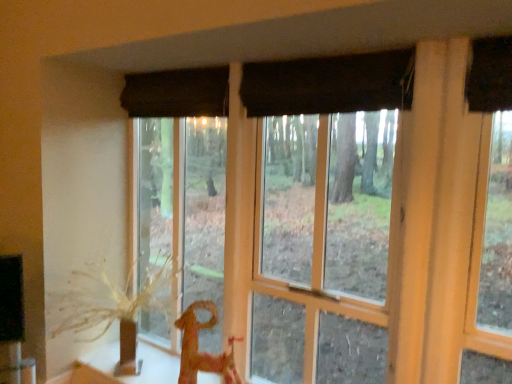
Question: From a real-world perspective, is black fabric curtain at upper center positioned above or below brown textured plant at left?

Choices:
 (A) above
 (B) below

Answer: (A)

Question: Choose the correct answer: Is black fabric curtain at upper center inside brown textured plant at left or outside it?

Choices:
 (A) outside
 (B) inside

Answer: (A)

Question: Based on their relative distances, which object is nearer to the matte brown curtain at center?

Choices:
 (A) brown textured plant at left
 (B) wooden horse at lower center
 (C) black fabric curtain at upper center

Answer: (C)

Question: Considering the real-world distances, which object is closest to the wooden horse at lower center?

Choices:
 (A) black fabric curtain at upper center
 (B) matte brown curtain at center
 (C) brown textured plant at left

Answer: (B)